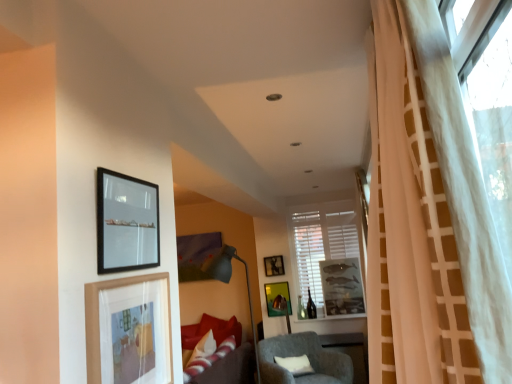
This screenshot has height=384, width=512. In order to click on matte black picture frame at upper center, the 3th picture frame in the left-to-right sequence in this screenshot , I will do `click(274, 266)`.

What do you see at coordinates (342, 286) in the screenshot?
I see `wooden textured picture frame at center, the third picture frame viewed from the front` at bounding box center [342, 286].

Measure the distance between point (x=253, y=339) and camera.

Point (x=253, y=339) is 5.03 meters from camera.

This screenshot has width=512, height=384. What are the coordinates of `white sheer curtain at right` in the screenshot? It's located at (429, 218).

Identify the location of matte black picture frame at upper center, which is the first picture frame from back to front. (274, 266).

Identify the location of lamp below the wooden textured picture frame at center, the third picture frame viewed from the front (from a real-world perspective). (228, 282).

Considering the sizes of objects matte gray floor lamp at center and wooden textured picture frame at center, positioned as the third picture frame in back-to-front order, in the image provided, who is bigger, matte gray floor lamp at center or wooden textured picture frame at center, positioned as the third picture frame in back-to-front order,?

matte gray floor lamp at center.

From the picture: Would you say matte gray floor lamp at center is inside or outside wooden textured picture frame at center, positioned as the third picture frame in back-to-front order?

matte gray floor lamp at center is not inside wooden textured picture frame at center, positioned as the third picture frame in back-to-front order, it's outside.

Does matte gray floor lamp at center turn towards wooden textured picture frame at center, positioned as the third picture frame in back-to-front order?

No.

In terms of height, does gray fabric chair at center look taller or shorter compared to black matte picture frame at upper left, which is the 2th picture frame from front to back?

In the image, gray fabric chair at center appears to be taller than black matte picture frame at upper left, which is the 2th picture frame from front to back.

Could black matte picture frame at upper left, the fourth picture frame positioned from the back, be considered to be inside gray fabric chair at center?

No, gray fabric chair at center does not contain black matte picture frame at upper left, the fourth picture frame positioned from the back.

From the picture: Who is smaller, gray fabric chair at center or black matte picture frame at upper left, which ranks as the 5th picture frame in right-to-left order?

black matte picture frame at upper left, which ranks as the 5th picture frame in right-to-left order.

From their relative heights in the image, would you say wooden textured picture frame at center, the third picture frame viewed from the front, is taller or shorter than wooden picture frame at lower left, acting as the 1th picture frame starting from the front?

In the image, wooden textured picture frame at center, the third picture frame viewed from the front, appears to be taller than wooden picture frame at lower left, acting as the 1th picture frame starting from the front.

Considering the positions of objects wooden textured picture frame at center, positioned as the third picture frame in back-to-front order, and wooden picture frame at lower left, the second picture frame in the left-to-right sequence, in the image provided, who is in front, wooden textured picture frame at center, positioned as the third picture frame in back-to-front order, or wooden picture frame at lower left, the second picture frame in the left-to-right sequence,?

wooden picture frame at lower left, the second picture frame in the left-to-right sequence, is more forward.

Locate an element on the screen. This screenshot has width=512, height=384. the 3rd picture frame counting from the left side of the wooden textured picture frame at center, which is counted as the 5th picture frame, starting from the left is located at coordinates (129, 330).

Considering the sizes of objects wooden textured picture frame at center, the 1th picture frame when ordered from right to left, and wooden picture frame at lower left, marked as the fifth picture frame in a back-to-front arrangement, in the image provided, who is wider, wooden textured picture frame at center, the 1th picture frame when ordered from right to left, or wooden picture frame at lower left, marked as the fifth picture frame in a back-to-front arrangement,?

wooden textured picture frame at center, the 1th picture frame when ordered from right to left.

Between point (248, 299) and point (301, 341), which one is positioned in front?

The point (301, 341) is closer.

Looking at this image, considering the relative positions of matte gray floor lamp at center and gray fabric chair at center in the image provided, is matte gray floor lamp at center behind gray fabric chair at center?

Yes, matte gray floor lamp at center is further from the camera.

Measure the distance between matte gray floor lamp at center and gray fabric chair at center.

A distance of 3.70 feet exists between matte gray floor lamp at center and gray fabric chair at center.

Find the location of a particular element. The height and width of the screenshot is (384, 512). curtain in front of the white matte window at center is located at coordinates (429, 218).

Is white matte window at center turned away from white sheer curtain at right?

No, white sheer curtain at right is not at the back of white matte window at center.

Considering the relative sizes of white matte window at center and white sheer curtain at right in the image provided, is white matte window at center wider than white sheer curtain at right?

No, white matte window at center is not wider than white sheer curtain at right.

Is matte black picture frame at upper center, the 3th picture frame in the left-to-right sequence, situated inside black matte picture frame at upper left, which is the 2th picture frame from front to back, or outside?

The correct answer is: outside.

Looking at this image, is matte black picture frame at upper center, the 3th picture frame in the left-to-right sequence, looking in the opposite direction of black matte picture frame at upper left, which ranks as the 5th picture frame in right-to-left order?

matte black picture frame at upper center, the 3th picture frame in the left-to-right sequence, is not turned away from black matte picture frame at upper left, which ranks as the 5th picture frame in right-to-left order.

Which is more distant, (279, 256) or (150, 254)?

The point (279, 256) is farther from the camera.

From the image's perspective, which is above, matte black picture frame at upper center, which appears as the 5th picture frame when viewed from the front, or black matte picture frame at upper left, the fourth picture frame positioned from the back?

black matte picture frame at upper left, the fourth picture frame positioned from the back.

Considering their positions, is wooden textured picture frame at center, the third picture frame viewed from the front, located in front of or behind matte black picture frame at upper center, the 3th picture frame in the left-to-right sequence?

Clearly, wooden textured picture frame at center, the third picture frame viewed from the front, is in front of matte black picture frame at upper center, the 3th picture frame in the left-to-right sequence.

Between wooden textured picture frame at center, which is counted as the 5th picture frame, starting from the left, and matte black picture frame at upper center, which appears as the 5th picture frame when viewed from the front, which one has larger size?

With larger size is wooden textured picture frame at center, which is counted as the 5th picture frame, starting from the left.

From the image's perspective, which one is positioned higher, wooden textured picture frame at center, which is counted as the 5th picture frame, starting from the left, or matte black picture frame at upper center, the 3th picture frame in the right-to-left sequence?

matte black picture frame at upper center, the 3th picture frame in the right-to-left sequence, from the image's perspective.

How many degrees apart are the facing directions of wooden textured picture frame at center, the 1th picture frame when ordered from right to left, and matte black picture frame at upper center, the 3th picture frame in the left-to-right sequence?

1.89 degrees.

Starting from the matte gray floor lamp at center, which picture frame is the 3rd one to the right? Please provide its 2D coordinates.

[(342, 286)]

Starting from the gray fabric chair at center, which picture frame is the 4th one to the left? Please provide its 2D coordinates.

[(126, 223)]

Based on their spatial positions, is wooden picture frame at lower left, marked as the fifth picture frame in a back-to-front arrangement, or gray fabric chair at center closer to black matte picture frame at upper left, which is the 2th picture frame from front to back?

wooden picture frame at lower left, marked as the fifth picture frame in a back-to-front arrangement, is positioned closer to the anchor black matte picture frame at upper left, which is the 2th picture frame from front to back.

Which object lies further to the anchor point black matte picture frame at upper left, which ranks as the 5th picture frame in right-to-left order, matte gray floor lamp at center or white matte window at center?

white matte window at center lies further to black matte picture frame at upper left, which ranks as the 5th picture frame in right-to-left order, than the other object.

When comparing their distances from white matte window at center, does matte black picture frame at upper center, which is the first picture frame from back to front, or metallic gold picture frame at center, the 4th picture frame from the front, seem closer?

matte black picture frame at upper center, which is the first picture frame from back to front, is positioned closer to the anchor white matte window at center.

Looking at the image, which one is located further to gray fabric chair at center, matte gray floor lamp at center or wooden picture frame at lower left, placed as the 4th picture frame when sorted from right to left?

wooden picture frame at lower left, placed as the 4th picture frame when sorted from right to left, lies further to gray fabric chair at center than the other object.

Consider the image. Estimate the real-world distances between objects in this image. Which object is further from black matte picture frame at upper left, the fourth picture frame positioned from the back, gray fabric chair at center or wooden textured picture frame at center, the 1th picture frame when ordered from right to left?

wooden textured picture frame at center, the 1th picture frame when ordered from right to left, is positioned further to the anchor black matte picture frame at upper left, the fourth picture frame positioned from the back.

Considering their positions, is wooden textured picture frame at center, the 1th picture frame when ordered from right to left, positioned closer to white sheer curtain at right than white matte window at center?

Among the two, white matte window at center is located nearer to white sheer curtain at right.

Looking at the image, which one is located further to matte gray floor lamp at center, white sheer curtain at right or black matte picture frame at upper left, which is the 2th picture frame from front to back?

white sheer curtain at right.

Which object lies further to the anchor point matte gray floor lamp at center, metallic gold picture frame at center, which is the second picture frame in back-to-front order, or black matte picture frame at upper left, the fourth picture frame positioned from the back?

black matte picture frame at upper left, the fourth picture frame positioned from the back, is further to matte gray floor lamp at center.

The image size is (512, 384). I want to click on chair positioned between black matte picture frame at upper left, the fourth picture frame positioned from the back, and matte black picture frame at upper center, the 3th picture frame in the left-to-right sequence, from near to far, so click(x=308, y=358).

Locate an element on the screen. The height and width of the screenshot is (384, 512). chair positioned between wooden picture frame at lower left, acting as the 1th picture frame starting from the front, and matte black picture frame at upper center, which appears as the 5th picture frame when viewed from the front, from near to far is located at coordinates (308, 358).

Find the location of a particular element. The height and width of the screenshot is (384, 512). lamp positioned between black matte picture frame at upper left, which is the 2th picture frame from front to back, and matte black picture frame at upper center, the 3th picture frame in the right-to-left sequence, from near to far is located at coordinates (228, 282).

Where is `window positioned between black matte picture frame at upper left, the fourth picture frame positioned from the back, and matte black picture frame at upper center, the 3th picture frame in the left-to-right sequence, from near to far`? window positioned between black matte picture frame at upper left, the fourth picture frame positioned from the back, and matte black picture frame at upper center, the 3th picture frame in the left-to-right sequence, from near to far is located at coordinates (325, 252).